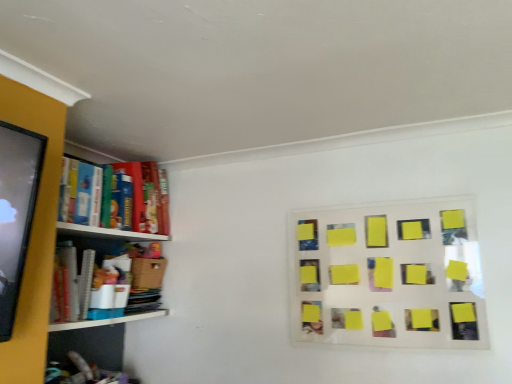
Identify the location of free space above yellow sticky notes at upper right (from a real-world perspective). This screenshot has width=512, height=384. (370, 198).